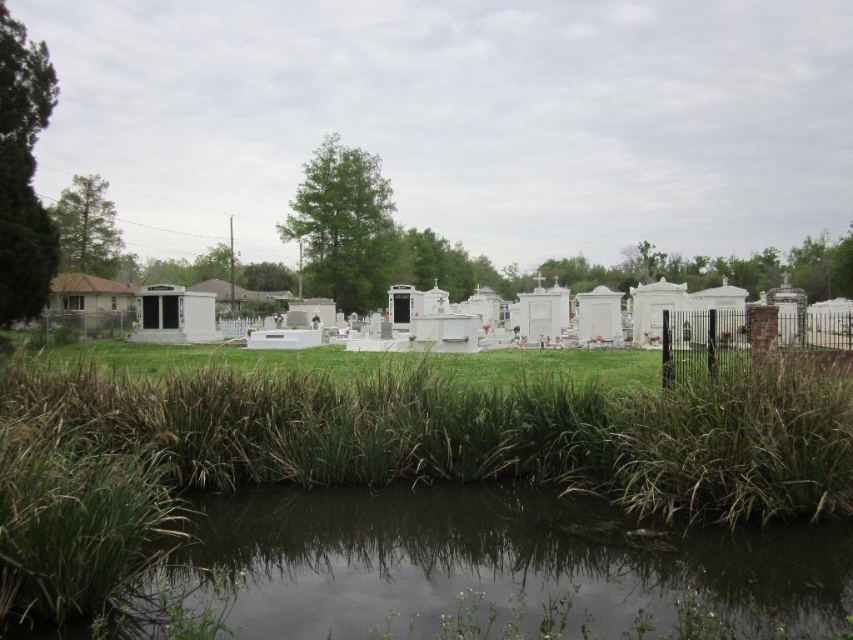
Can you confirm if green grassy water at lower center is shorter than black wrought iron fence at right?

Indeed, green grassy water at lower center has a lesser height compared to black wrought iron fence at right.

Is point (241, 532) behind point (767, 353)?

No, it is in front of (767, 353).

You are a GUI agent. You are given a task and a screenshot of the screen. Output one action in this format:
    pyautogui.click(x=<x>, y=<y>)
    Task: Click on the green grassy water at lower center
    Image resolution: width=853 pixels, height=640 pixels.
    Given the screenshot: What is the action you would take?
    pyautogui.click(x=492, y=566)

Does green grass at lower center appear on the right side of green grassy water at lower center?

No, green grass at lower center is not to the right of green grassy water at lower center.

Can you confirm if green grass at lower center is positioned to the left of green grassy water at lower center?

Yes, green grass at lower center is to the left of green grassy water at lower center.

Between point (210, 426) and point (825, 595), which one is positioned behind?

The point (210, 426) is more distant.

Image resolution: width=853 pixels, height=640 pixels. Find the location of `green grass at lower center`. green grass at lower center is located at coordinates (500, 444).

Does green grass at lower center lie behind black wrought iron fence at right?

No.

Based on the photo, can you confirm if green grass at lower center is taller than black wrought iron fence at right?

Indeed, green grass at lower center has a greater height compared to black wrought iron fence at right.

Between point (630, 408) and point (668, 388), which one is positioned behind?

The point (668, 388) is more distant.

The width and height of the screenshot is (853, 640). I want to click on green grass at lower center, so click(x=500, y=444).